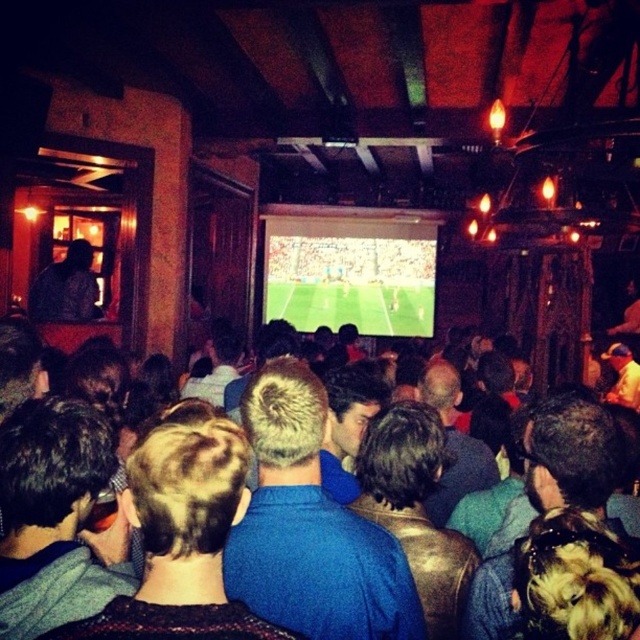
Question: Does short blonde hair at center appear on the left side of dark brown hair at center?

Choices:
 (A) no
 (B) yes

Answer: (A)

Question: Which point is farther to the camera?

Choices:
 (A) dark brown hair at center
 (B) short blonde hair at center

Answer: (A)

Question: Can you confirm if brown leather jacket at center is positioned above dark brown leather jacket at center?

Choices:
 (A) yes
 (B) no

Answer: (B)

Question: Is dark brown leather jacket at center positioned in front of blue shirt at center?

Choices:
 (A) no
 (B) yes

Answer: (B)

Question: Which point is closer to the camera?

Choices:
 (A) blue cotton shirt at center
 (B) short blonde hair at center

Answer: (B)

Question: Which of the following is the farthest from the observer?

Choices:
 (A) (301, 504)
 (B) (368, 280)

Answer: (B)